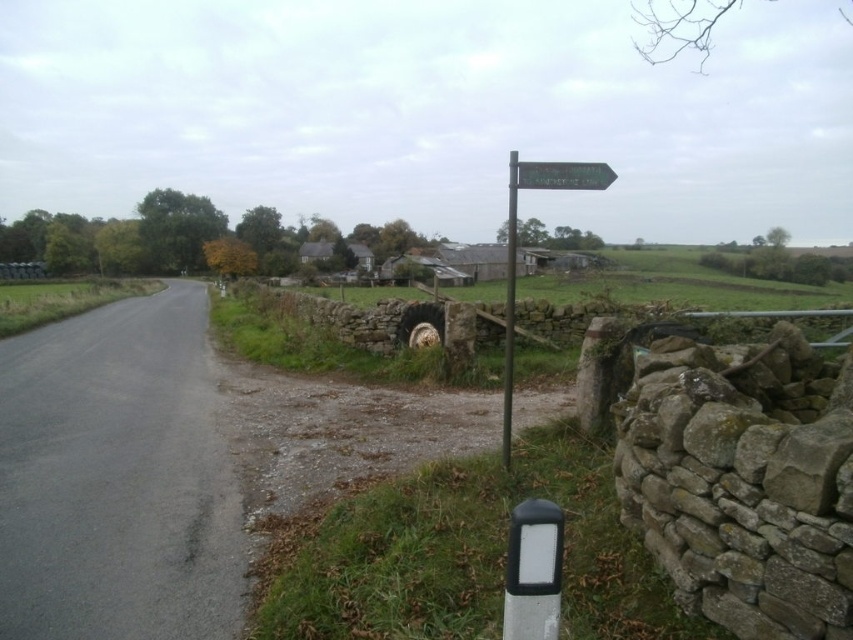
Is silver metallic signpost at upper center in front of green wooden signpost at upper right?

That is False.

Where is `silver metallic signpost at upper center`? This screenshot has width=853, height=640. silver metallic signpost at upper center is located at coordinates (509, 307).

Does green plastic signpost at center-right come behind silver metallic signpost at upper center?

That is False.

Is green plastic signpost at center-right in front of silver metallic signpost at upper center?

That is True.

Is point (578, 188) closer to viewer compared to point (508, 161)?

Yes, it is.

Where is `green plastic signpost at center-right`? Image resolution: width=853 pixels, height=640 pixels. green plastic signpost at center-right is located at coordinates (515, 244).

Looking at this image, can you confirm if green plastic signpost at center-right is wider than green wooden signpost at upper right?

Yes.

Is green plastic signpost at center-right to the right of green wooden signpost at upper right from the viewer's perspective?

Correct, you'll find green plastic signpost at center-right to the right of green wooden signpost at upper right.

You are a GUI agent. You are given a task and a screenshot of the screen. Output one action in this format:
    pyautogui.click(x=<x>, y=<y>)
    Task: Click on the green plastic signpost at center-right
    
    Given the screenshot: What is the action you would take?
    pyautogui.click(x=515, y=244)

This screenshot has height=640, width=853. I want to click on green plastic signpost at center-right, so click(515, 244).